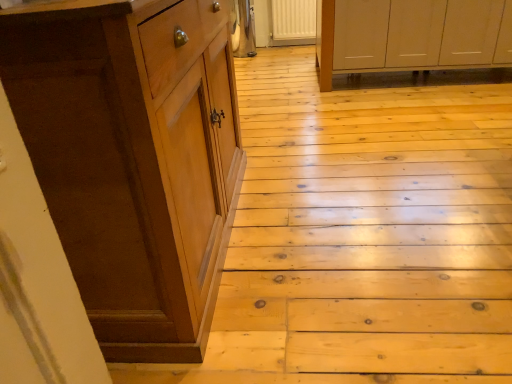
Question: Would you say brown wood cabinet at left, which is the first cabinetry from front to back, contains wooden at left?

Choices:
 (A) yes
 (B) no

Answer: (B)

Question: Considering the relative sizes of brown wood cabinet at left, which is the 2th cabinetry in top-to-bottom order, and wooden at left in the image provided, is brown wood cabinet at left, which is the 2th cabinetry in top-to-bottom order, wider than wooden at left?

Choices:
 (A) yes
 (B) no

Answer: (B)

Question: Is brown wood cabinet at left, the first cabinetry viewed from the left, to the left of wooden at left from the viewer's perspective?

Choices:
 (A) yes
 (B) no

Answer: (A)

Question: Is brown wood cabinet at left, the first cabinetry ordered from the bottom, positioned behind wooden at left?

Choices:
 (A) no
 (B) yes

Answer: (A)

Question: Can you confirm if brown wood cabinet at left, which is the 2th cabinetry in back-to-front order, is thinner than wooden at left?

Choices:
 (A) no
 (B) yes

Answer: (B)

Question: Based on their sizes in the image, would you say white matte cabinet at upper right, positioned as the 2th cabinetry in left-to-right order, is bigger or smaller than wooden at left?

Choices:
 (A) big
 (B) small

Answer: (A)

Question: From the image's perspective, relative to wooden at left, is white matte cabinet at upper right, arranged as the 2th cabinetry when viewed from the front, above or below?

Choices:
 (A) above
 (B) below

Answer: (A)

Question: Do you think white matte cabinet at upper right, positioned as the 2th cabinetry in left-to-right order, is within wooden at left, or outside of it?

Choices:
 (A) inside
 (B) outside

Answer: (B)

Question: In the image, is white matte cabinet at upper right, the first cabinetry from the right, on the left side or the right side of wooden at left?

Choices:
 (A) right
 (B) left

Answer: (A)

Question: Is wooden at left taller or shorter than white matte cabinet at upper right, the first cabinetry from the right?

Choices:
 (A) short
 (B) tall

Answer: (A)

Question: Is wooden at left inside the boundaries of white matte cabinet at upper right, arranged as the 2th cabinetry when viewed from the front, or outside?

Choices:
 (A) outside
 (B) inside

Answer: (A)

Question: From a real-world perspective, is wooden at left positioned above or below white matte cabinet at upper right, arranged as the 2th cabinetry when viewed from the front?

Choices:
 (A) below
 (B) above

Answer: (A)

Question: Is point (510, 241) positioned closer to the camera than point (357, 46)?

Choices:
 (A) farther
 (B) closer

Answer: (B)

Question: Looking at their shapes, would you say brown wood cabinet at left, the first cabinetry viewed from the left, is wider or thinner than white matte cabinet at upper right, the first cabinetry from the right?

Choices:
 (A) thin
 (B) wide

Answer: (A)

Question: Relative to white matte cabinet at upper right, arranged as the 1th cabinetry when viewed from the top, is brown wood cabinet at left, which is the 2th cabinetry in top-to-bottom order, in front or behind?

Choices:
 (A) behind
 (B) front

Answer: (B)